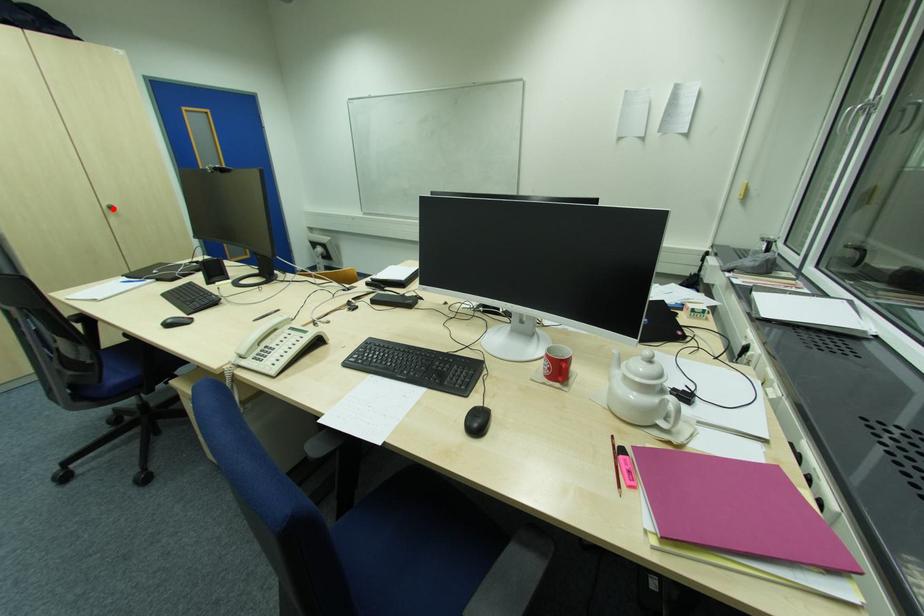
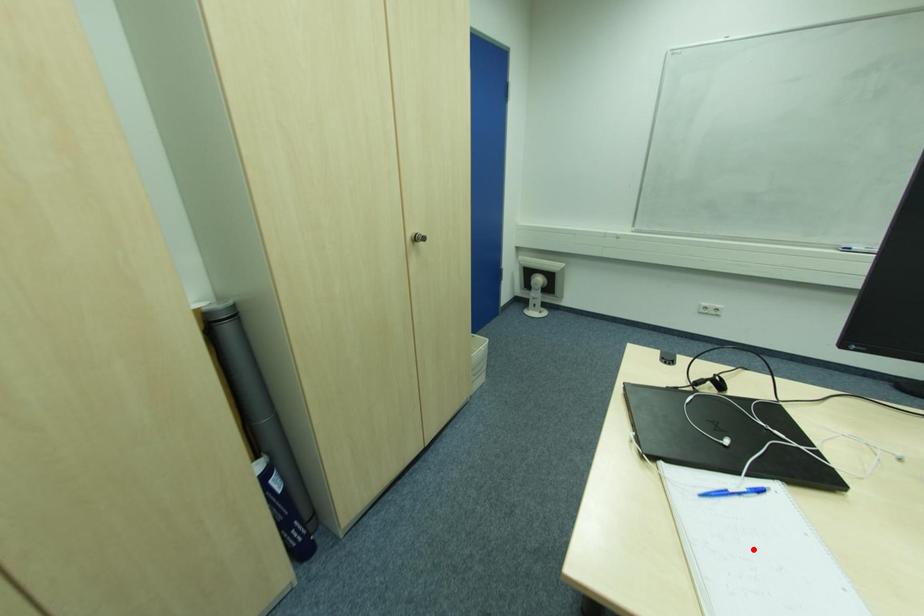
I am providing you with two images of the same scene from different viewpoints. A red point is marked on the first image and another point is marked on the second image. Are the points marked in image1 and image2 representing the same 3D position?

No